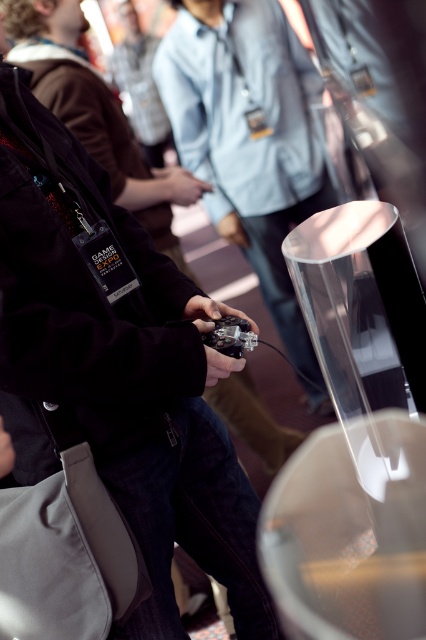
Is matte black jacket at center bigger than metallic black game controller at center?

Yes, matte black jacket at center is bigger than metallic black game controller at center.

Which is in front, point (13, 60) or point (215, 340)?

Positioned in front is point (215, 340).

You are a GUI agent. You are given a task and a screenshot of the screen. Output one action in this format:
    pyautogui.click(x=<x>, y=<y>)
    Task: Click on the matte black jacket at center
    
    Given the screenshot: What is the action you would take?
    pyautogui.click(x=95, y=115)

Where is `matte black jacket at center`? This screenshot has height=640, width=426. matte black jacket at center is located at coordinates (95, 115).